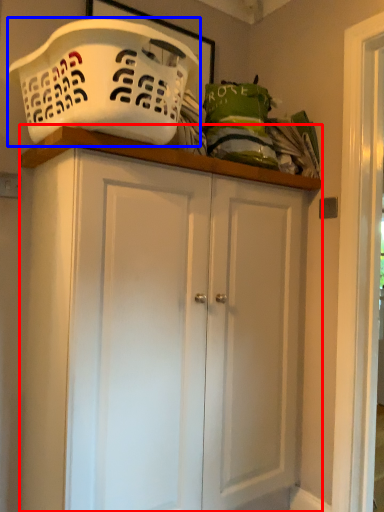
Question: Which object appears closest to the camera in this image, cupboard (highlighted by a red box) or basket container (highlighted by a blue box)?

Choices:
 (A) cupboard
 (B) basket container

Answer: (B)